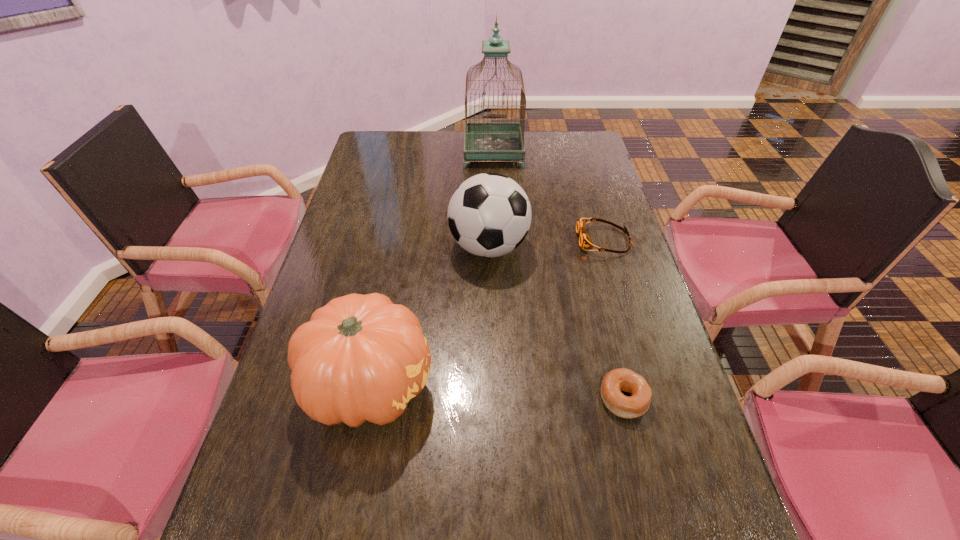
Where is `vacant space that is in between the goggles and the bagel`? vacant space that is in between the goggles and the bagel is located at coordinates pyautogui.click(x=613, y=319).

The height and width of the screenshot is (540, 960). What are the coordinates of `vacant region between the bagel and the leftmost object` in the screenshot? It's located at (497, 392).

You are a GUI agent. You are given a task and a screenshot of the screen. Output one action in this format:
    pyautogui.click(x=<x>, y=<y>)
    Task: Click on the free point between the goggles and the tallest object
    Image resolution: width=960 pixels, height=540 pixels.
    Given the screenshot: What is the action you would take?
    click(548, 196)

In order to click on vacant space that is in between the tallest object and the pumpkin in this screenshot , I will do `click(432, 268)`.

Identify the location of free space between the soccer ball and the leftmost object. (429, 316).

Identify the location of blank region between the tallest object and the goggles. The image size is (960, 540). (548, 196).

Locate an element on the screen. empty location between the goggles and the tallest object is located at coordinates (548, 196).

Find the location of a particular element. The width and height of the screenshot is (960, 540). free point between the pumpkin and the goggles is located at coordinates (487, 313).

Locate which object ranks second in proximity to the tallest object. Please provide its 2D coordinates. Your answer should be formatted as a tuple, i.e. [(x, y)], where the tuple contains the x and y coordinates of a point satisfying the conditions above.

[(585, 241)]

At what (x,y) coordinates should I click in order to perform the action: click on object that is the second closest to the birdcage. Please return your answer as a coordinate pair (x, y). Looking at the image, I should click on (585, 241).